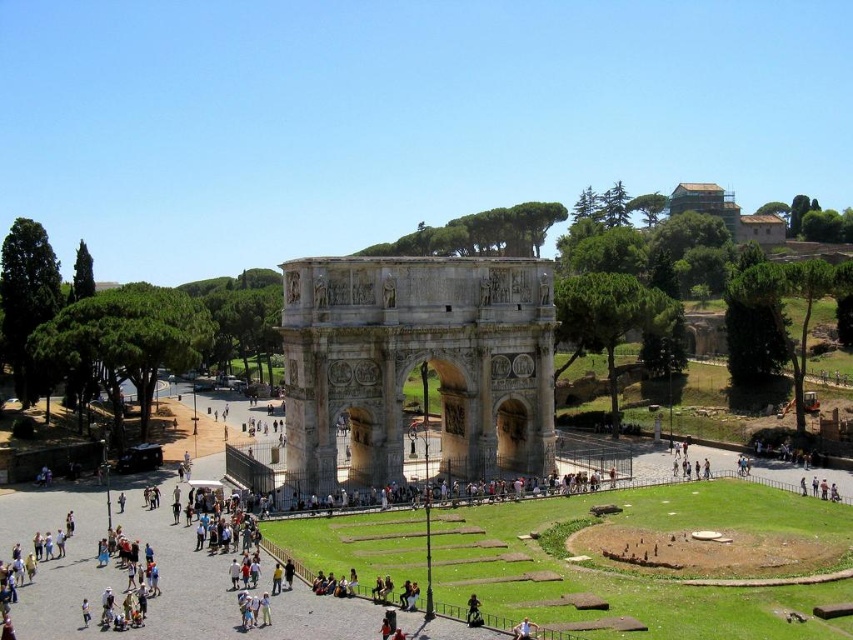
You are a tourist standing at the entrance of the historical site and want to take a photo of the beige stone arch at center and the brown wooden house at upper right. Which object appears taller in the photo?

The beige stone arch at center has a lesser height compared to brown wooden house at upper right, so the brown wooden house at upper right appears taller in the photo.

You are a tourist standing at the entrance of the historical site and want to take a photo of the beige stone arch at center and the brown wooden house at upper right. Which object should you point your camera towards first to capture both in the frame?

You should point your camera towards the beige stone arch at center first because it is located below the brown wooden house at upper right, so adjusting the angle to include both would require framing from the lower position upwards.